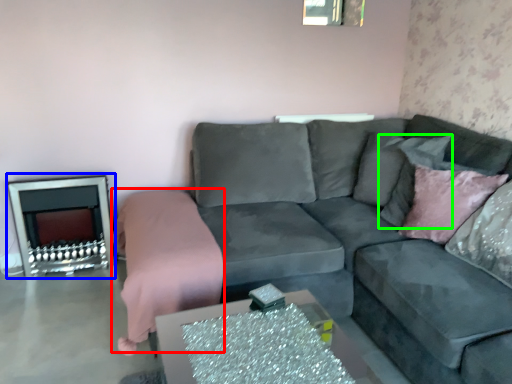
Question: Which is nearer to the bedding (highlighted by a red box)? fireplace (highlighted by a blue box) or pillow (highlighted by a green box).

Choices:
 (A) fireplace
 (B) pillow

Answer: (A)